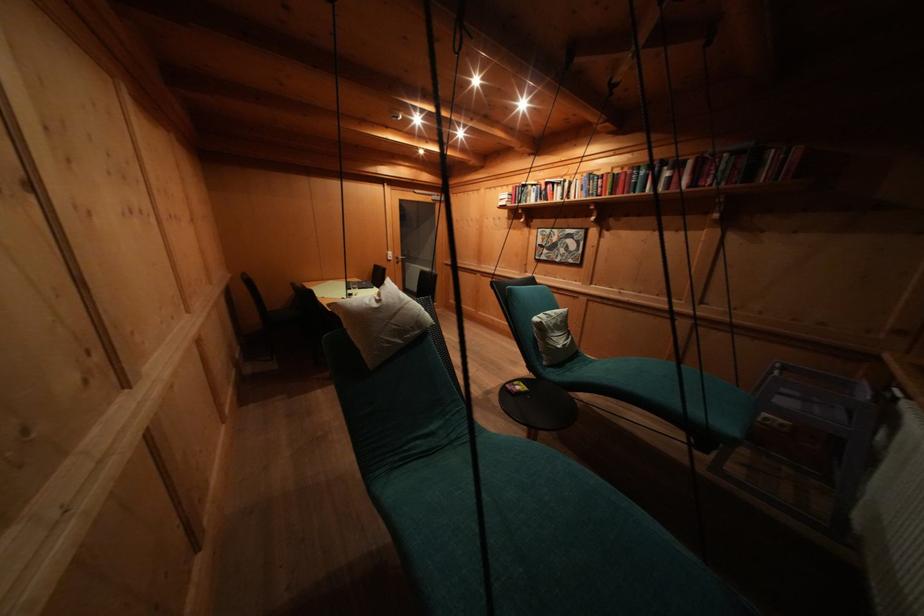
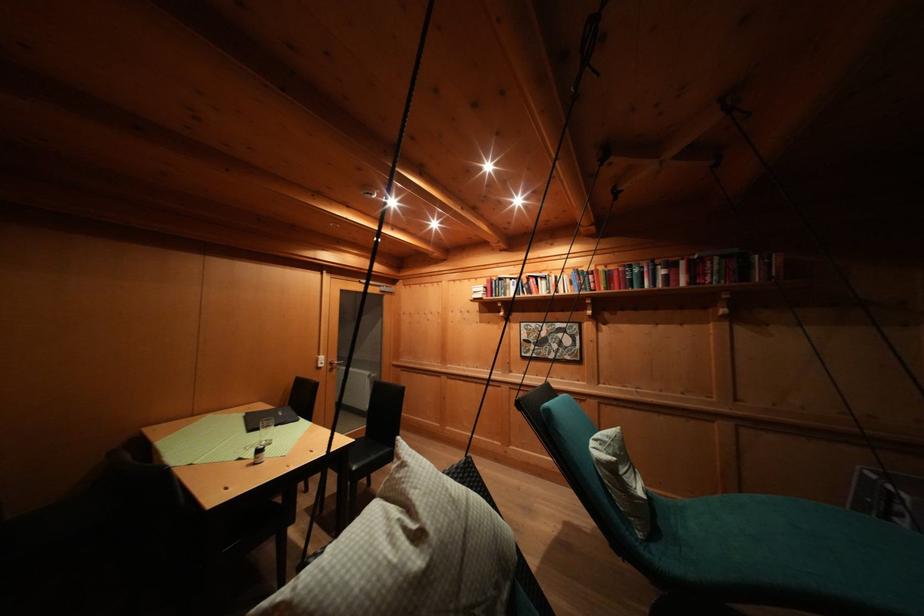
Locate, in the second image, the point that corresponds to pixel 377 305 in the first image.

(396, 541)